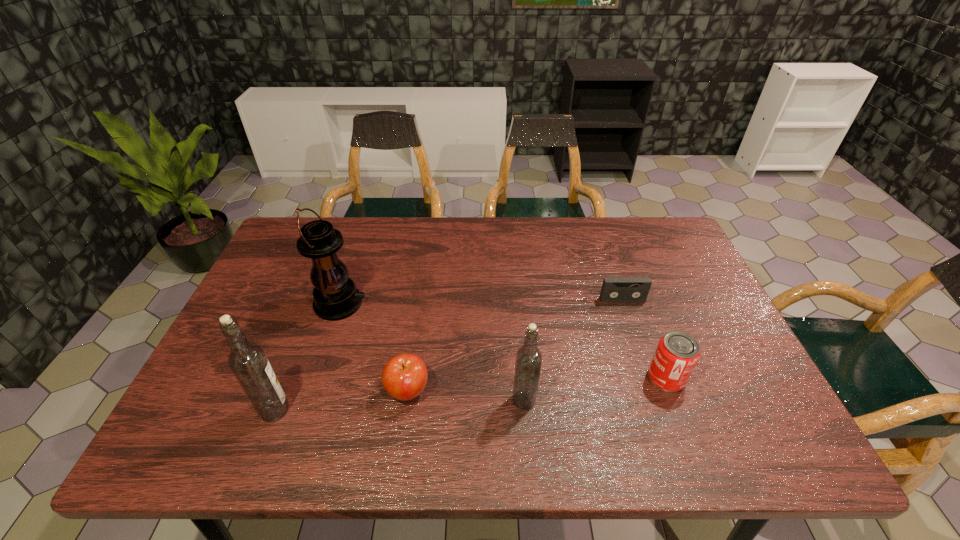
At what (x,y) coordinates should I click in order to perform the action: click on free space between the lantern and the left vodka. Please return your answer as a coordinate pair (x, y). This screenshot has height=540, width=960. Looking at the image, I should click on (307, 357).

This screenshot has width=960, height=540. Find the location of `vacant point located between the left vodka and the apple`. vacant point located between the left vodka and the apple is located at coordinates (341, 401).

At what (x,y) coordinates should I click in order to perform the action: click on free space between the lantern and the third shortest object. Please return your answer as a coordinate pair (x, y). Looking at the image, I should click on (503, 341).

Identify which object is located as the fifth nearest to the shortest object. Please provide its 2D coordinates. Your answer should be formatted as a tuple, i.e. [(x, y)], where the tuple contains the x and y coordinates of a point satisfying the conditions above.

[(247, 360)]

Locate an element on the screen. object that can be found as the third closest to the videotape is located at coordinates (404, 377).

Identify the location of free space that satisfies the following two spatial constraints: 1. above the apple, indicating its light source; 2. on the right side of the lantern. The width and height of the screenshot is (960, 540). (312, 391).

Find the location of a particular element. free spot that satisfies the following two spatial constraints: 1. on the front-facing side of the videotape; 2. on the label of the third object from right to left is located at coordinates (656, 400).

Image resolution: width=960 pixels, height=540 pixels. In order to click on free location that satisfies the following two spatial constraints: 1. above the lantern, indicating its light source; 2. on the right side of the can in this screenshot , I will do `click(316, 378)`.

I want to click on free space that satisfies the following two spatial constraints: 1. above the lantern, indicating its light source; 2. on the back side of the can, so tap(316, 378).